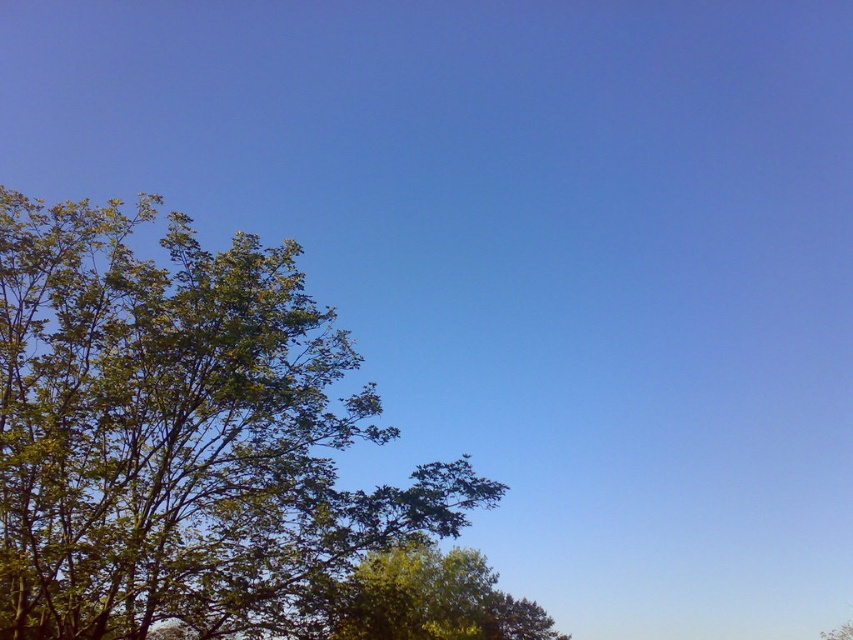
You are standing in a park and see the green leafy tree at left and the green leafy tree at lower center. Which tree has a wider trunk?

The green leafy tree at lower center has a wider trunk than the green leafy tree at left.